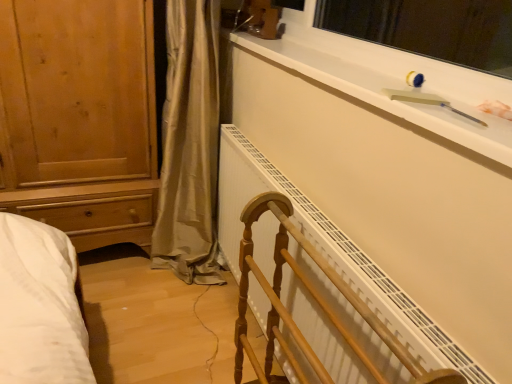
Question: From a real-world perspective, does wooden towel rack at center stand above white matte window sill at upper right?

Choices:
 (A) yes
 (B) no

Answer: (B)

Question: Is wooden towel rack at center to the right of white matte window sill at upper right from the viewer's perspective?

Choices:
 (A) yes
 (B) no

Answer: (B)

Question: Is wooden towel rack at center aimed at white matte window sill at upper right?

Choices:
 (A) yes
 (B) no

Answer: (B)

Question: Is wooden towel rack at center smaller than white matte window sill at upper right?

Choices:
 (A) no
 (B) yes

Answer: (A)

Question: Does wooden towel rack at center have a larger size compared to white matte window sill at upper right?

Choices:
 (A) yes
 (B) no

Answer: (A)

Question: From the image's perspective, would you say wooden towel rack at center is positioned over white matte window sill at upper right?

Choices:
 (A) no
 (B) yes

Answer: (A)

Question: Can you confirm if wooden towel rack at center is taller than white plastic window screen at upper right?

Choices:
 (A) yes
 (B) no

Answer: (A)

Question: Is wooden towel rack at center oriented towards white plastic window screen at upper right?

Choices:
 (A) yes
 (B) no

Answer: (B)

Question: Is wooden towel rack at center wider than white plastic window screen at upper right?

Choices:
 (A) no
 (B) yes

Answer: (B)

Question: From the image's perspective, is wooden towel rack at center on white plastic window screen at upper right?

Choices:
 (A) no
 (B) yes

Answer: (A)

Question: Considering the relative positions of wooden towel rack at center and white plastic window screen at upper right in the image provided, is wooden towel rack at center to the left of white plastic window screen at upper right from the viewer's perspective?

Choices:
 (A) yes
 (B) no

Answer: (A)

Question: Can you confirm if wooden towel rack at center is bigger than white plastic window screen at upper right?

Choices:
 (A) no
 (B) yes

Answer: (B)

Question: Is white matte window sill at upper right completely or partially outside of white plastic window screen at upper right?

Choices:
 (A) yes
 (B) no

Answer: (A)